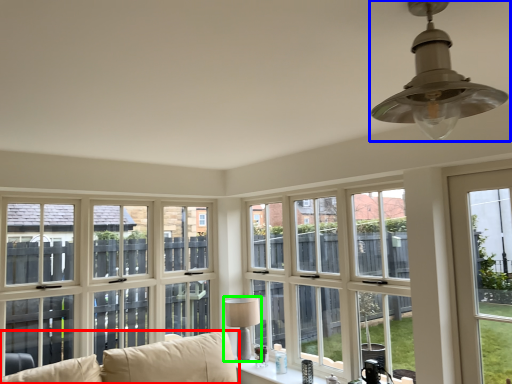
Question: Considering the real-world distances, which object is closest to studio couch (highlighted by a red box)? lamp (highlighted by a blue box) or lamp (highlighted by a green box).

Choices:
 (A) lamp
 (B) lamp

Answer: (B)